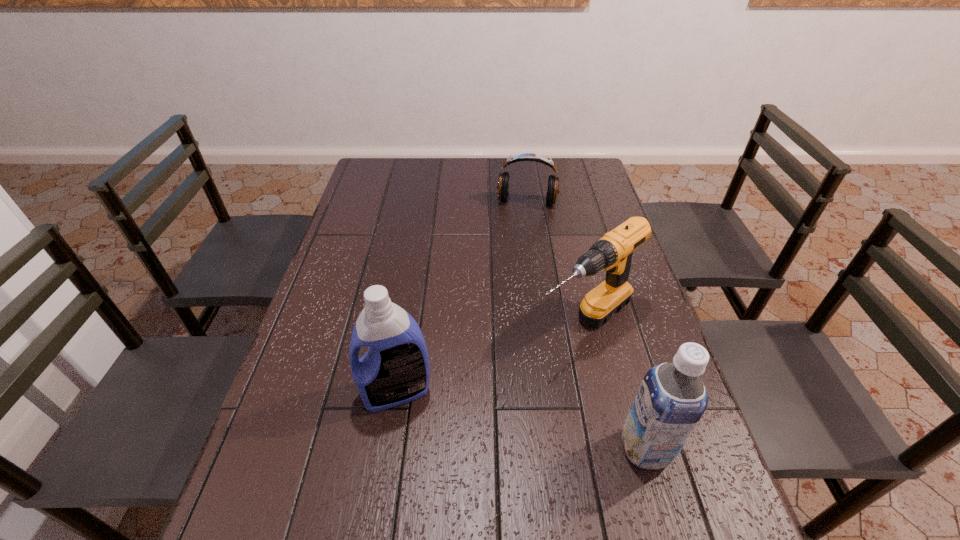
Where is `blank space located at the tip of the second farthest object`? blank space located at the tip of the second farthest object is located at coordinates (501, 389).

This screenshot has height=540, width=960. What are the coordinates of `vacant space situated on the ear cups of the headset` in the screenshot? It's located at (518, 260).

This screenshot has width=960, height=540. I want to click on vacant space located on the ear cups of the headset, so click(517, 273).

This screenshot has height=540, width=960. Find the location of `blank space located 0.140m on the ear cups of the headset`. blank space located 0.140m on the ear cups of the headset is located at coordinates (521, 235).

Image resolution: width=960 pixels, height=540 pixels. Find the location of `object that is at the near edge`. object that is at the near edge is located at coordinates (671, 400).

I want to click on soya milk that is positioned at the right edge, so click(671, 400).

Image resolution: width=960 pixels, height=540 pixels. I want to click on drill that is at the right edge, so click(613, 252).

Where is `object that is at the near right corner`? This screenshot has width=960, height=540. object that is at the near right corner is located at coordinates pyautogui.click(x=671, y=400).

Where is `vacant space at the far edge of the desktop`? vacant space at the far edge of the desktop is located at coordinates (510, 166).

The image size is (960, 540). Find the location of `vacant space at the near edge of the desktop`. vacant space at the near edge of the desktop is located at coordinates (379, 468).